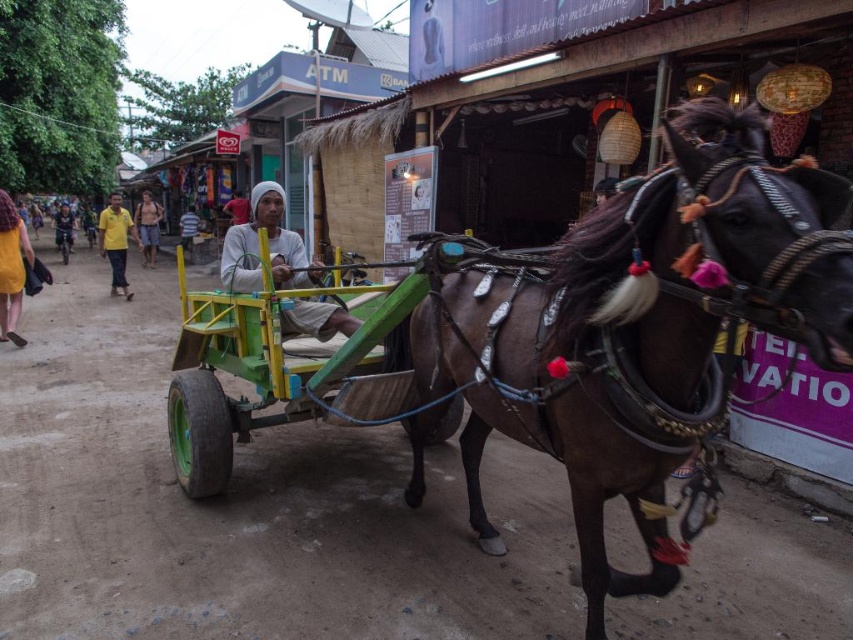
You are a photographer standing on the sidewalk observing the skinny man at center and the white striped shirt at center. Which object is taller?

The white striped shirt at center is taller than the skinny man at center.

You are standing at the center of the street and see the white matte cloth at center and the yellow shirt at left. If you want to reach both items, which one would you need to walk towards first to get closer to them?

Since the white matte cloth at center is 10.02 meters away from the yellow shirt at left, you would need to walk towards the yellow shirt at left first to get closer to both items because they are positioned in opposite directions from your current position at the center.